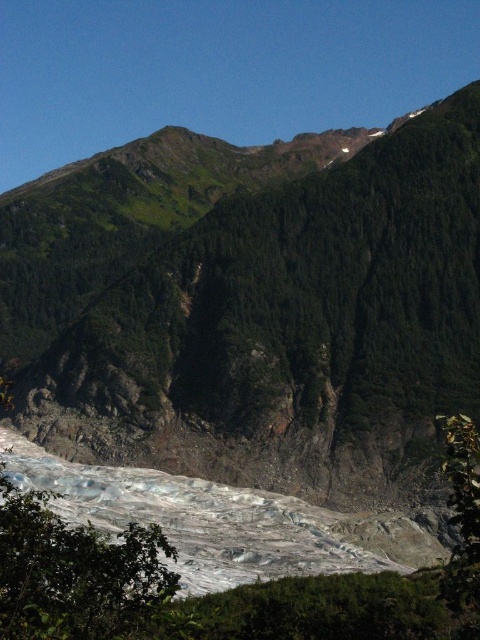
You are a hiker planning to take a photo of the green leafy tree at lower left and the green rocky mountain at upper center. Which object should you position closer to the left side of your camera frame to capture both in the shot?

You should position the green leafy tree at lower left closer to the left side of your camera frame because the green rocky mountain at upper center is on the right side of the green leafy tree at lower left.

You are a hiker standing at the base of the green leafy tree at lower left. Looking towards the green rocky mountain at upper center, which direction should you head to get closer to the mountain?

Since the green rocky mountain at upper center is closer to you than the green leafy tree at lower left, you are already at the base of the tree which is near the mountain. To get closer to the mountain, you should head towards the upper center direction where the mountain is located.

You are a hiker standing at the base of the green rocky mountain at upper center. You want to take a photo of it using a camera that has a maximum focus range of 120 meters. Will the camera be able to focus on the mountain?

The green rocky mountain at upper center and the camera are 119.72 meters apart. Since the camera can focus up to 120 meters, it will just barely be able to focus on the mountain.